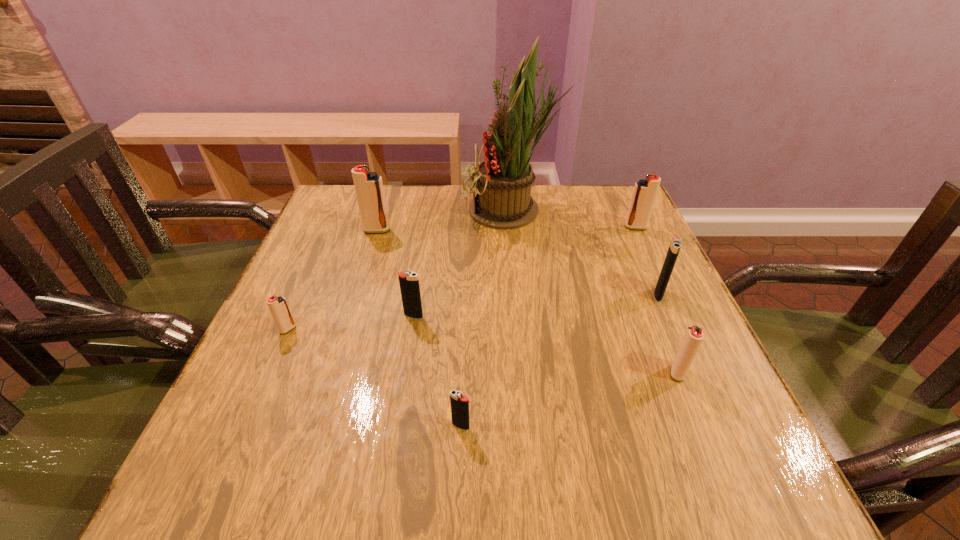
This screenshot has width=960, height=540. Identify the location of free space between the rightmost red igniter and the leftmost black igniter. (524, 272).

This screenshot has height=540, width=960. Identify the location of the closest object to the smallest red igniter. (409, 284).

What are the coordinates of `the third closest object to the flower arrangement` in the screenshot? It's located at (675, 245).

Find the location of a particular element. igniter object that ranks as the fifth closest to the second tallest object is located at coordinates (675, 245).

Where is `the second closest igniter to the nearest red igniter`? Image resolution: width=960 pixels, height=540 pixels. the second closest igniter to the nearest red igniter is located at coordinates (459, 403).

You are a GUI agent. You are given a task and a screenshot of the screen. Output one action in this format:
    pyautogui.click(x=<x>, y=<y>)
    Task: Click on the red igniter that stands as the fourth closest to the farthest black igniter
    
    Given the screenshot: What is the action you would take?
    pyautogui.click(x=278, y=306)

Locate which red igniter ranks in proximity to the second nearest black igniter. Please provide its 2D coordinates. Your answer should be formatted as a tuple, i.e. [(x, y)], where the tuple contains the x and y coordinates of a point satisfying the conditions above.

[(278, 306)]

Find the location of `the second closest black igniter relative to the smallest red igniter`. the second closest black igniter relative to the smallest red igniter is located at coordinates (459, 403).

Locate which black igniter ranks third in proximity to the tallest object. Please provide its 2D coordinates. Your answer should be formatted as a tuple, i.e. [(x, y)], where the tuple contains the x and y coordinates of a point satisfying the conditions above.

[(459, 403)]

Where is `vacant region that satisfies the following two spatial constraints: 1. in front of the tallest object with the fan visible; 2. on the front side of the fifth farthest igniter`? This screenshot has height=540, width=960. vacant region that satisfies the following two spatial constraints: 1. in front of the tallest object with the fan visible; 2. on the front side of the fifth farthest igniter is located at coordinates (524, 329).